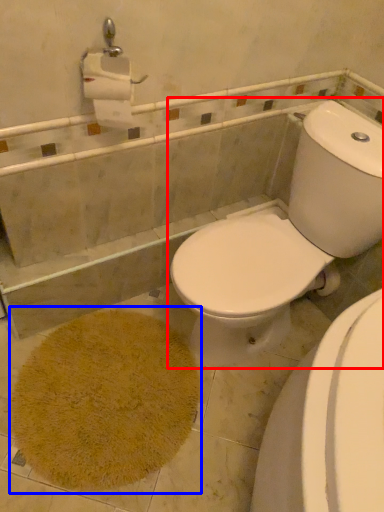
Question: Which object appears farthest to the camera in this image, toilet (highlighted by a red box) or bath mat (highlighted by a blue box)?

Choices:
 (A) toilet
 (B) bath mat

Answer: (B)